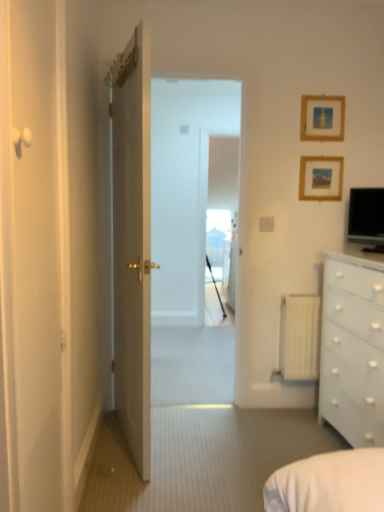
Find the location of `vacant space in front of white glossy door at center, acting as the 1th door starting from the back`. vacant space in front of white glossy door at center, acting as the 1th door starting from the back is located at coordinates (147, 483).